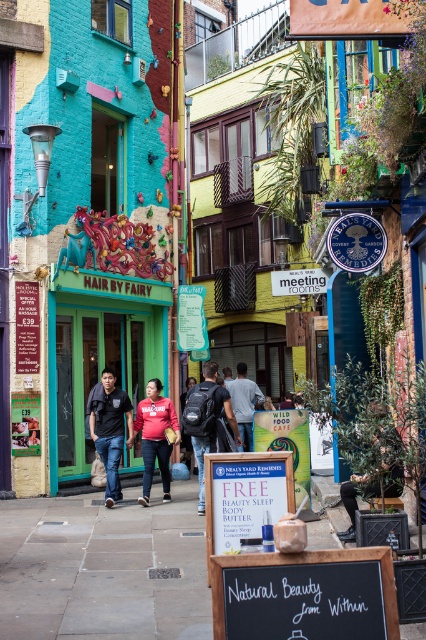
Between green matte door at center and red cotton hoodie at center, which one is positioned lower?

→ red cotton hoodie at center is below.

Is point (158, 312) farther from viewer compared to point (189, 444)?

Yes, it is.

This screenshot has height=640, width=426. Identify the location of green matte door at center. (103, 349).

Who is more distant from viewer, (178, 600) or (189, 416)?

Positioned behind is point (189, 416).

Who is higher up, smooth stone pavement at center or matte black backpack at center?

Positioned higher is matte black backpack at center.

The image size is (426, 640). Find the location of `smooth stone pavement at center`. smooth stone pavement at center is located at coordinates (103, 566).

Who is more distant from viewer, (155,627) or (241,417)?

Point (241,417)

Is smooth stone pavement at center to the left of matte gray backpack at center from the viewer's perspective?

Yes, smooth stone pavement at center is to the left of matte gray backpack at center.

Who is more distant from viewer, (x=163, y=637) or (x=236, y=381)?

The point (x=236, y=381) is more distant.

At what (x,y) coordinates should I click in order to perform the action: click on smooth stone pavement at center. Please return your answer as a coordinate pair (x, y). Looking at the image, I should click on (103, 566).